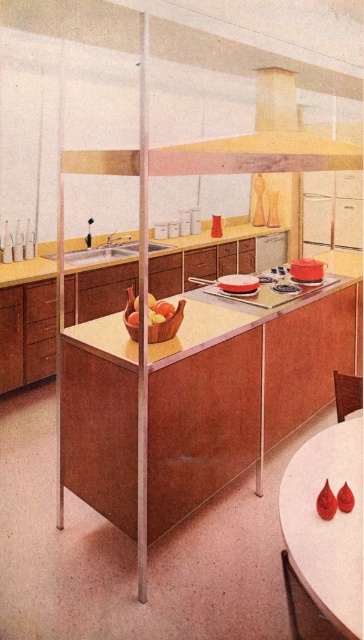
You are standing in the kitchen and want to place a 3.5 feet wide cutting board on the wooden table at center. Can you fit it on the table without it hanging over the edges?

The wooden table at center and viewer are 6.88 feet apart, but the description does not provide the table dimensions. Therefore, it is impossible to determine if the cutting board will fit without additional information.

Looking at this image, you are a kitchen designer planning to install a new faucet next to the satin nickel sink at center. Since the wooden chair at lower right is nearby, will the sink size affect the space needed for the faucet installation?

The satin nickel sink at center is larger in size than wooden chair at lower right. The sink size may require more space for the faucet installation, so ensure there is enough room around the sink to accommodate the faucet without interfering with the wooden chair at lower right.

You are a chef preparing to hang a decorative magnet on the kitchen wall. You want to place it to the left of the yellow matte exhaust hood at upper center but also to the right of the shiny golden apples at center. Is there enough space between them to do this?

The yellow matte exhaust hood at upper center is to the right of the shiny golden apples at center, so there is space between them to place the magnet to the left of the hood and to the right of the apples.